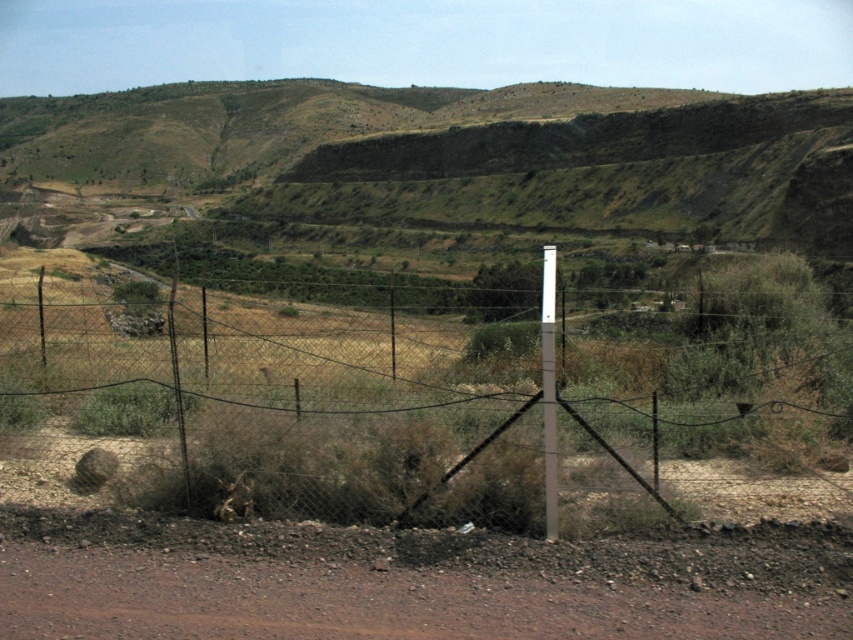
Does brown gravel dirt track at lower center have a larger size compared to metallic gray pole at center?

No.

Is brown gravel dirt track at lower center to the left of metallic gray pole at center from the viewer's perspective?

Indeed, brown gravel dirt track at lower center is positioned on the left side of metallic gray pole at center.

Which is in front, point (495, 618) or point (553, 516)?

Point (495, 618)

The image size is (853, 640). Identify the location of brown gravel dirt track at lower center. (410, 580).

Between green grassy hillside at upper center and brown gravel dirt track at lower center, which one is positioned lower?

brown gravel dirt track at lower center

Which is above, green grassy hillside at upper center or brown gravel dirt track at lower center?

green grassy hillside at upper center is above.

Between point (138, 122) and point (392, 616), which one is positioned in front?

Point (392, 616) is more forward.

Identify the location of green grassy hillside at upper center. (430, 177).

Does wire mesh fence at center appear on the right side of metallic gray pole at center?

No, wire mesh fence at center is not to the right of metallic gray pole at center.

Is point (405, 342) closer to viewer compared to point (541, 324)?

No.

Image resolution: width=853 pixels, height=640 pixels. Identify the location of wire mesh fence at center. (279, 406).